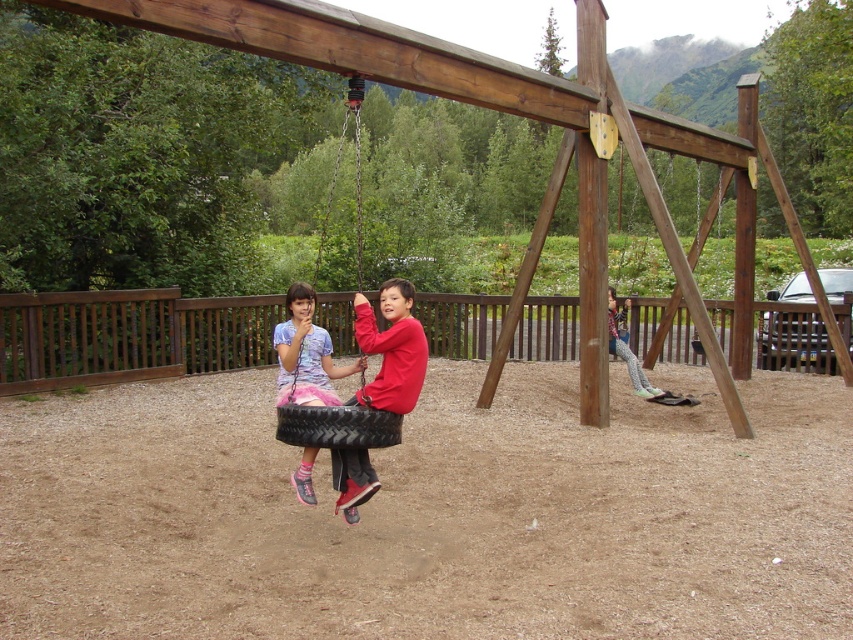
Question: Among these objects, which one is farthest from the camera?

Choices:
 (A) matte pink fabric tire swing at center
 (B) printed fabric pants at lower right

Answer: (B)

Question: Where is black rubber tire swing at center located in relation to black rubber tire at center in the image?

Choices:
 (A) above
 (B) below

Answer: (A)

Question: Is matte pink fabric tire swing at center positioned before black rubber tire swing at center?

Choices:
 (A) no
 (B) yes

Answer: (A)

Question: Which object is positioned farthest from the matte pink fabric tire swing at center?

Choices:
 (A) black rubber tire swing at center
 (B) printed fabric pants at lower right

Answer: (A)

Question: Among these points, which one is nearest to the camera?

Choices:
 (A) (370, 422)
 (B) (625, 355)
 (C) (310, 467)
 (D) (337, 163)

Answer: (A)

Question: Is matte pink fabric tire swing at center bigger than printed fabric pants at lower right?

Choices:
 (A) yes
 (B) no

Answer: (B)